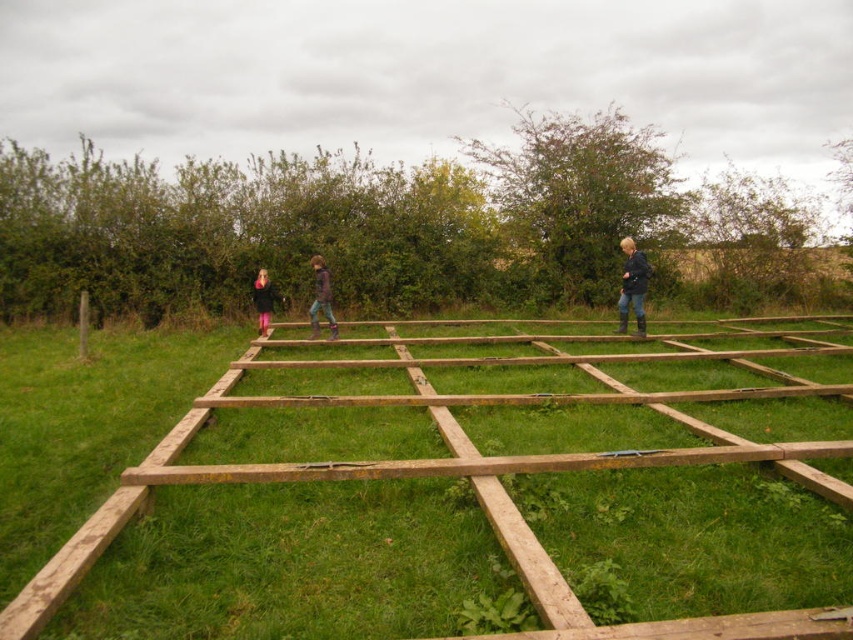
Does green grass at center have a greater height compared to dark blue jacket at center?

Incorrect, green grass at center's height is not larger of dark blue jacket at center's.

Does green grass at center have a lesser width compared to dark blue jacket at center?

No.

Who is more forward, (807, 422) or (628, 260)?

Point (807, 422) is more forward.

Where is `green grass at center`? green grass at center is located at coordinates (480, 492).

Identify the location of green grass at center. (480, 492).

Does green grass at center come in front of purple fuzzy jacket at center?

That is True.

Does point (611, 582) come closer to viewer compared to point (312, 308)?

Yes, it is in front of point (312, 308).

This screenshot has height=640, width=853. I want to click on green grass at center, so click(480, 492).

Can you confirm if purple fuzzy jacket at center is positioned above pink fabric pants at center?

Yes.

Describe the element at coordinates (321, 298) in the screenshot. I see `purple fuzzy jacket at center` at that location.

Find the location of `purple fuzzy jacket at center`. purple fuzzy jacket at center is located at coordinates (321, 298).